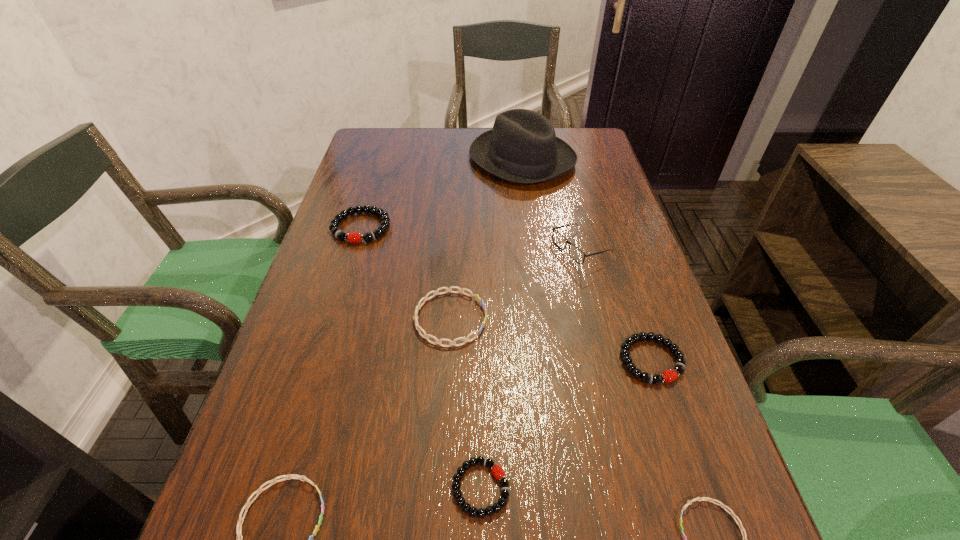
Identify the location of the second black bracelet from left to right. (497, 471).

The width and height of the screenshot is (960, 540). Find the location of `vacant area situated on the front of the farthest object`. vacant area situated on the front of the farthest object is located at coordinates (527, 202).

Image resolution: width=960 pixels, height=540 pixels. In order to click on free space located 0.230m with the lenses facing outward on the spectacles in this screenshot , I will do `click(457, 249)`.

Identify the location of free region located 0.090m with the lenses facing outward on the spectacles. (516, 249).

You are a GUI agent. You are given a task and a screenshot of the screen. Output one action in this format:
    pyautogui.click(x=<x>, y=<y>)
    Task: Click on the vacant space located with the lenses facing outward on the spectacles
    The height and width of the screenshot is (540, 960).
    Given the screenshot: What is the action you would take?
    494,249

Where is `vacant region located on the right of the leftmost black bracelet`? The image size is (960, 540). vacant region located on the right of the leftmost black bracelet is located at coordinates (459, 227).

What are the coordinates of `vacant region located on the surface of the second blue bracelet from right to left showing star-shaped elements` in the screenshot? It's located at (550, 319).

In order to click on vacant space located 0.170m on the left of the second biggest black bracelet in this screenshot , I will do `click(529, 360)`.

At what (x,y) coordinates should I click in order to perform the action: click on free location located 0.320m on the left of the nearest black bracelet. Please return your answer as a coordinate pair (x, y). Image resolution: width=960 pixels, height=540 pixels. Looking at the image, I should click on (240, 488).

This screenshot has width=960, height=540. What are the coordinates of `object that is positioned at the far edge` in the screenshot? It's located at (522, 147).